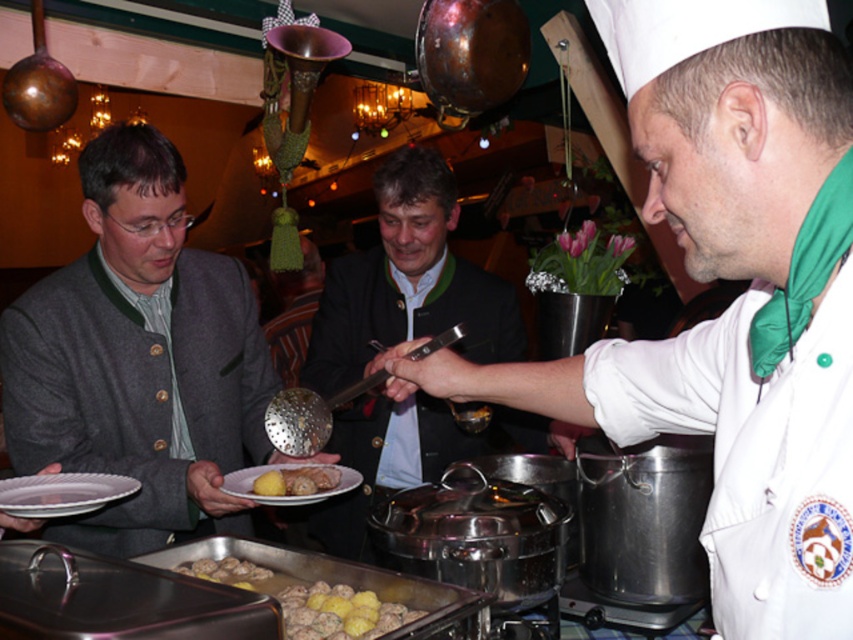
Who is higher up, white matte plate at center or brown matte meatballs at center?

white matte plate at center is above.

Which is behind, point (277, 500) or point (242, 582)?

Positioned behind is point (277, 500).

Does point (238, 476) come behind point (247, 577)?

Yes, point (238, 476) is behind point (247, 577).

You are a GUI agent. You are given a task and a screenshot of the screen. Output one action in this format:
    pyautogui.click(x=<x>, y=<y>)
    Task: Click on the white matte plate at center
    The height and width of the screenshot is (640, 853).
    Given the screenshot: What is the action you would take?
    pyautogui.click(x=286, y=496)

Between point (27, 486) and point (225, 556), which one is positioned behind?

The point (225, 556) is behind.

Does white glossy plate at lower left lie in front of brown matte meatballs at center?

Yes, white glossy plate at lower left is in front of brown matte meatballs at center.

Does point (51, 497) come closer to viewer compared to point (257, 570)?

That is True.

You are a GUI agent. You are given a task and a screenshot of the screen. Output one action in this format:
    pyautogui.click(x=<x>, y=<y>)
    Task: Click on the white glossy plate at lower left
    This screenshot has width=853, height=640.
    Given the screenshot: What is the action you would take?
    pyautogui.click(x=62, y=493)

What do you see at coordinates (62, 493) in the screenshot? Image resolution: width=853 pixels, height=640 pixels. I see `white glossy plate at lower left` at bounding box center [62, 493].

Based on the photo, is white glossy plate at lower left wider than yellow matte potato at center?

Yes, white glossy plate at lower left is wider than yellow matte potato at center.

Is point (55, 480) less distant than point (328, 484)?

Yes, point (55, 480) is closer to viewer.

Where is `white glossy plate at lower left`? The width and height of the screenshot is (853, 640). white glossy plate at lower left is located at coordinates (62, 493).